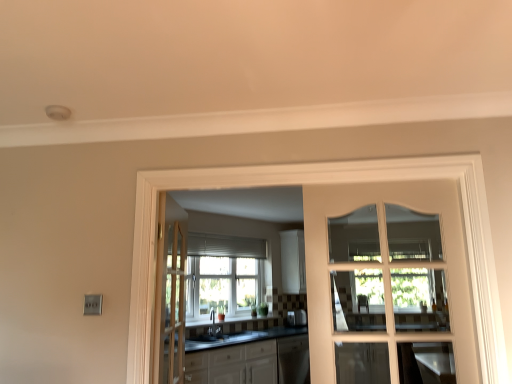
Find the location of a particular element. clear glass window at center is located at coordinates (223, 276).

The image size is (512, 384). What are the coordinates of `satin silver toaster at center` in the screenshot? It's located at (297, 318).

Locate an element on the screen. clear glass window at center is located at coordinates (223, 276).

This screenshot has width=512, height=384. I want to click on door above the light brown wooden door at center, the first door when ordered from back to front (from the image's perspective), so click(x=328, y=270).

In terms of size, does white glass door at center, marked as the 2th door in a left-to-right arrangement, appear bigger or smaller than light brown wooden door at center, the first door when ordered from back to front?

In the image, white glass door at center, marked as the 2th door in a left-to-right arrangement, appears to be smaller than light brown wooden door at center, the first door when ordered from back to front.

Is white glass door at center, marked as the 2th door in a left-to-right arrangement, positioned with its back to light brown wooden door at center, the first door when ordered from back to front?

No, white glass door at center, marked as the 2th door in a left-to-right arrangement, is not facing away from light brown wooden door at center, the first door when ordered from back to front.

Is white glass door at center, placed as the 1th door when sorted from front to back, not near light brown wooden door at center, the first door when ordered from back to front?

Yes, white glass door at center, placed as the 1th door when sorted from front to back, is far from light brown wooden door at center, the first door when ordered from back to front.

This screenshot has width=512, height=384. Identify the location of appliance located below the white glass door at center (from the image's perspective). (297, 318).

From a real-world perspective, is satin silver toaster at center under white glass door at center?

Yes, from a real-world perspective, satin silver toaster at center is under white glass door at center.

Considering the relative sizes of satin silver toaster at center and white glass door at center in the image provided, is satin silver toaster at center shorter than white glass door at center?

Yes.

From the image's perspective, does clear glass window at center appear higher than light brown wooden door at center, which is the 2th door in right-to-left order?

No, from the image's perspective, clear glass window at center is not above light brown wooden door at center, which is the 2th door in right-to-left order.

From the picture: From a real-world perspective, is clear glass window at center beneath light brown wooden door at center, the first door when ordered from back to front?

No, from a real-world perspective, clear glass window at center is not beneath light brown wooden door at center, the first door when ordered from back to front.

What's the angular difference between clear glass window at center and light brown wooden door at center, which is the 2th door in right-to-left order,'s facing directions?

There is a 46.8-degree angle between the facing directions of clear glass window at center and light brown wooden door at center, which is the 2th door in right-to-left order.

Consider the image. Is matte black sink at center smaller than white glossy cabinets at center?

Yes, matte black sink at center is smaller than white glossy cabinets at center.

Which is in front, matte black sink at center or white glossy cabinets at center?

white glossy cabinets at center.

Is matte black sink at center turned away from white glossy cabinets at center?

Yes, matte black sink at center is positioned with its back facing white glossy cabinets at center.

Which object is positioned more to the right, matte black sink at center or white glossy cabinets at center?

Positioned to the right is matte black sink at center.

Is the depth of light brown wooden door at center, the first door when ordered from back to front, less than that of white glass door at center?

No, it is not.

Is light brown wooden door at center, which is the 2th door in right-to-left order, looking in the opposite direction of white glass door at center?

No, light brown wooden door at center, which is the 2th door in right-to-left order, is not facing away from white glass door at center.

Is light brown wooden door at center, which is the 1th door from left to right, to the right of white glass door at center from the viewer's perspective?

In fact, light brown wooden door at center, which is the 1th door from left to right, is to the left of white glass door at center.

From the image's perspective, is light brown wooden door at center, which ranks as the 2th door in front-to-back order, on white glass door at center?

No.

Visually, is light brown wooden door at center, which ranks as the 2th door in front-to-back order, positioned to the left or to the right of matte black sink at center?

light brown wooden door at center, which ranks as the 2th door in front-to-back order, is to the left of matte black sink at center.

From the image's perspective, is light brown wooden door at center, which ranks as the 2th door in front-to-back order, above or below matte black sink at center?

Clearly, from the image's perspective, light brown wooden door at center, which ranks as the 2th door in front-to-back order, is above matte black sink at center.

In the scene shown: Which point is more distant from viewer, (169, 356) or (188, 348)?

Positioned behind is point (188, 348).

Is light brown wooden door at center, which is the 1th door from left to right, in front of or behind matte black sink at center in the image?

In the image, light brown wooden door at center, which is the 1th door from left to right, appears in front of matte black sink at center.

Image resolution: width=512 pixels, height=384 pixels. I want to click on appliance lying behind the clear glass window at center, so click(x=297, y=318).

Looking at this image, is satin silver toaster at center beside clear glass window at center?

No.

Does satin silver toaster at center have a smaller size compared to clear glass window at center?

Yes.

Consider the image. Which point is more distant from viewer, [293,313] or [209,276]?

The point [293,313] is more distant.

The image size is (512, 384). In the image, there is a light brown wooden door at center, which is the 2th door in right-to-left order. What are the coordinates of `door above it (from the image's perspective)` in the screenshot? It's located at (328, 270).

You are a GUI agent. You are given a task and a screenshot of the screen. Output one action in this format:
    pyautogui.click(x=<x>, y=<y>)
    Task: Click on the window frame on the left of satin silver toaster at center
    This screenshot has width=512, height=384.
    Given the screenshot: What is the action you would take?
    pyautogui.click(x=324, y=183)

When comparing their distances from matte black sink at center, does white glass door at center, the first door from the right, or satin silver toaster at center seem further?

white glass door at center, the first door from the right, is positioned further to the anchor matte black sink at center.

Based on their spatial positions, is matte black sink at center or white glass door at center further from satin silver toaster at center?

white glass door at center.

Based on their spatial positions, is white glass door at center or clear glass window at center further from satin silver toaster at center?

white glass door at center is positioned further to the anchor satin silver toaster at center.

Based on the photo, from the image, which object appears to be farther from clear glass window at center, matte black sink at center or light brown wooden door at center, the first door when ordered from back to front?

light brown wooden door at center, the first door when ordered from back to front.

Estimate the real-world distances between objects in this image. Which object is further from clear glass window at center, matte black sink at center or white glass door at center, the first door from the right?

white glass door at center, the first door from the right, is positioned further to the anchor clear glass window at center.

From the image, which object appears to be farther from satin silver toaster at center, clear glass window at center or light brown wooden door at center, which ranks as the 2th door in front-to-back order?

light brown wooden door at center, which ranks as the 2th door in front-to-back order.

From the image, which object appears to be nearer to matte black sink at center, white glossy cabinets at center or light brown wooden door at center, which is the 1th door from left to right?

white glossy cabinets at center lies closer to matte black sink at center than the other object.

Estimate the real-world distances between objects in this image. Which object is closer to white glass door at center, light brown wooden door at center, the first door when ordered from back to front, or white glass door at center, which is the second door in back-to-front order?

white glass door at center, which is the second door in back-to-front order, is closer to white glass door at center.

The height and width of the screenshot is (384, 512). Identify the location of sink between white glossy cabinets at center and satin silver toaster at center from front to back. (227, 339).

At what (x,y) coordinates should I click in order to perform the action: click on window located between light brown wooden door at center, which ranks as the 2th door in front-to-back order, and satin silver toaster at center in the depth direction. Please return your answer as a coordinate pair (x, y). Looking at the image, I should click on (223, 276).

Identify the location of door between white glass door at center, the first door from the right, and clear glass window at center, along the z-axis. (170, 297).

Identify the location of cabinetry between light brown wooden door at center, which is the 1th door from left to right, and matte black sink at center in the front-back direction. The image size is (512, 384). (250, 358).